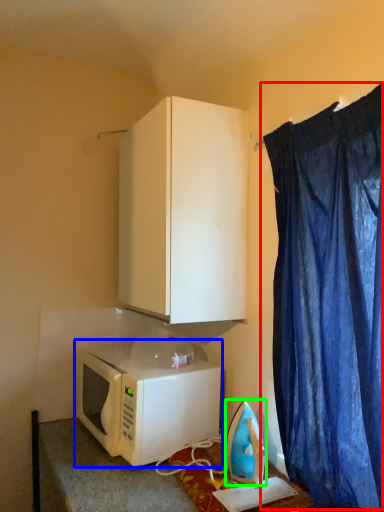
Question: Based on their relative distances, which object is farther from curtain (highlighted by a red box)? Choose from microwave oven (highlighted by a blue box) and appliance (highlighted by a green box).

Choices:
 (A) microwave oven
 (B) appliance

Answer: (A)